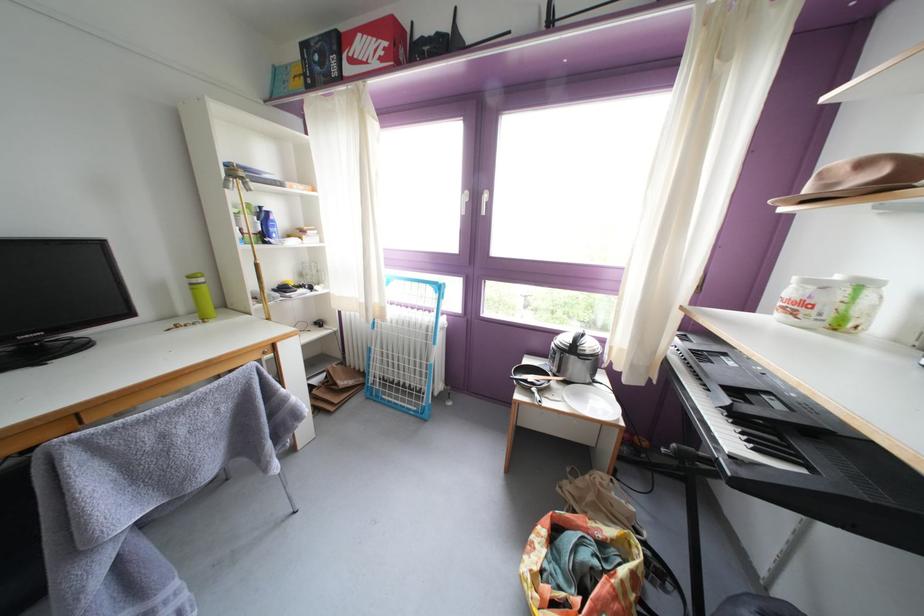
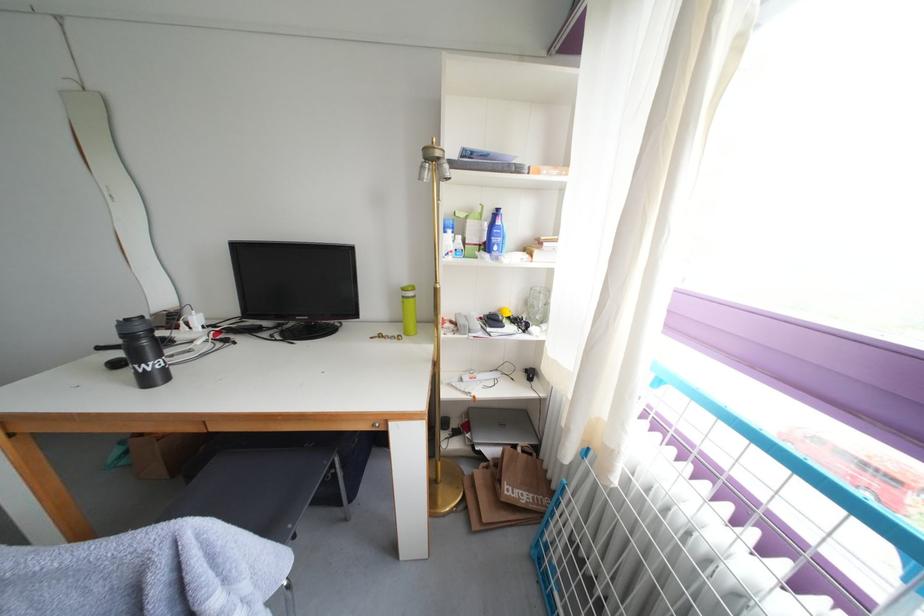
In the second image, find the point that corresponds to [324,387] in the first image.

(499, 456)